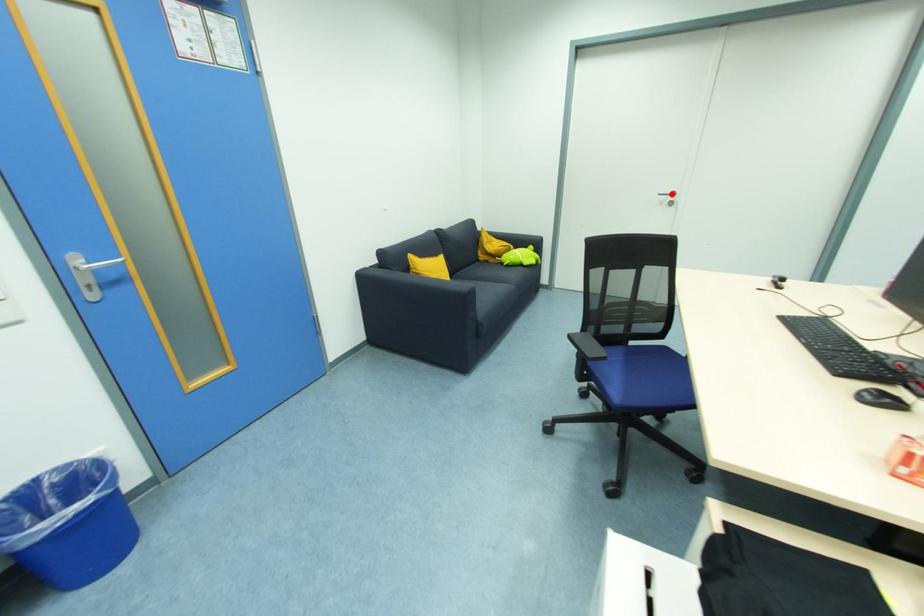
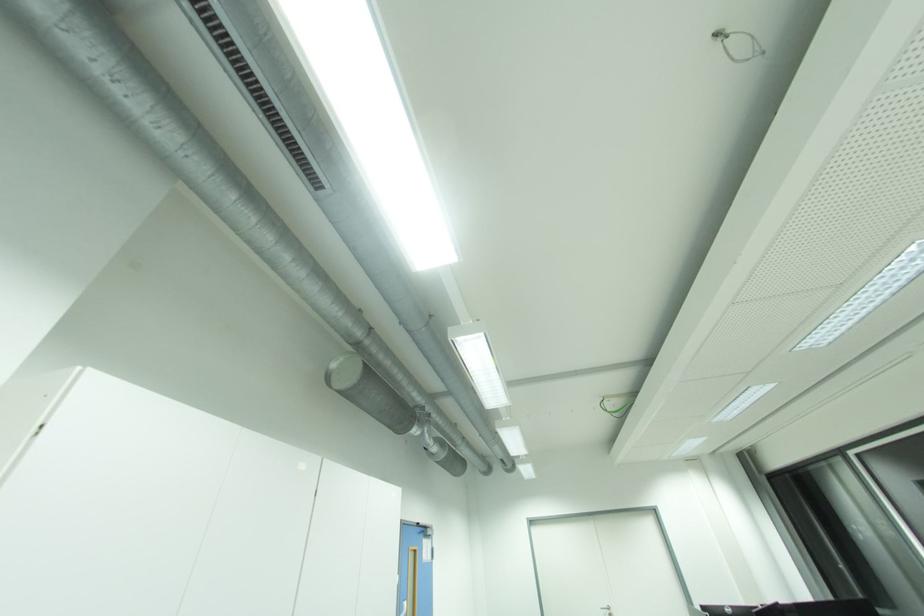
Find the pixel in the second image that matches the highlighted location in the first image.

(610, 609)